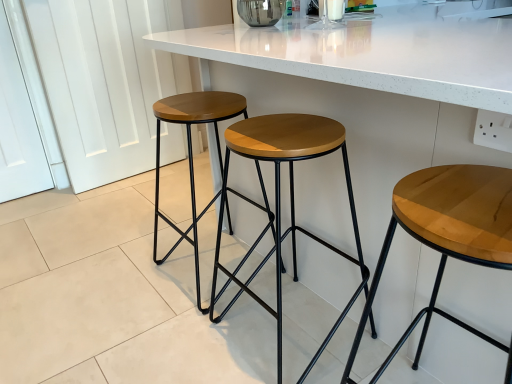
Where is `free spot to the left of woodenmaterial/texturestool at center, positioned as the second stool in right-to-left order`? The width and height of the screenshot is (512, 384). free spot to the left of woodenmaterial/texturestool at center, positioned as the second stool in right-to-left order is located at coordinates (180, 339).